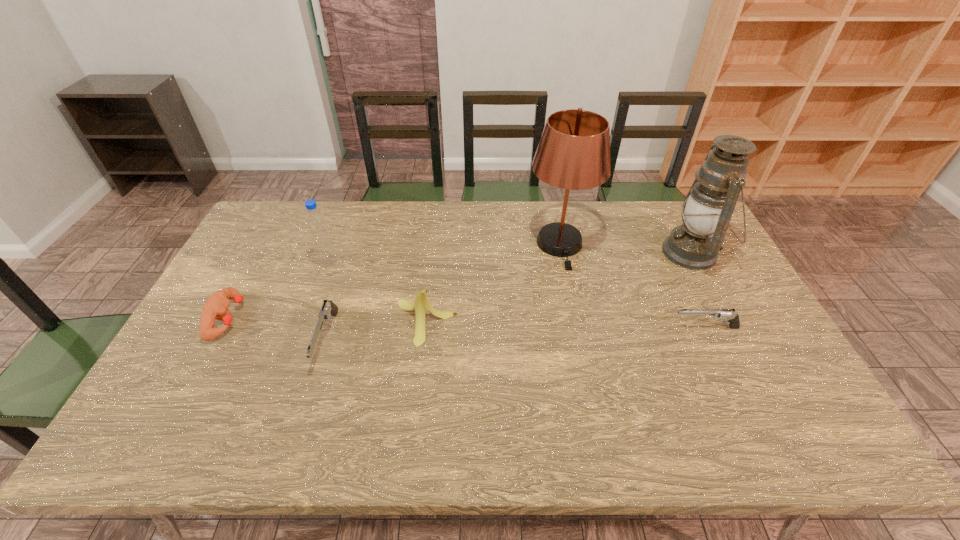
The width and height of the screenshot is (960, 540). Identify the location of the fifth closest object to the puncher. coord(732,318).

Identify which object is the closest to the puncher. Please provide its 2D coordinates. Your answer should be formatted as a tuple, i.e. [(x, y)], where the tuple contains the x and y coordinates of a point satisfying the conditions above.

[(316, 223)]

Find the location of a particular element. The width and height of the screenshot is (960, 540). free space that satisfies the following two spatial constraints: 1. on the back side of the fourth object from right to left; 2. on the right side of the oil lamp is located at coordinates (434, 253).